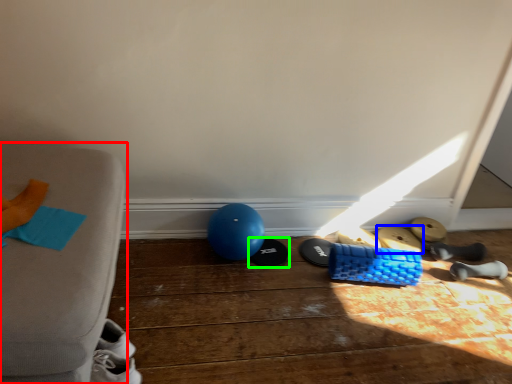
Question: Based on their relative distances, which object is farther from furniture (highlighted by a red box)? Choose from footwear (highlighted by a blue box) and footwear (highlighted by a green box).

Choices:
 (A) footwear
 (B) footwear

Answer: (A)